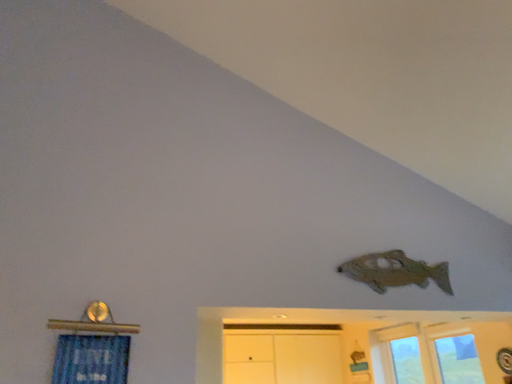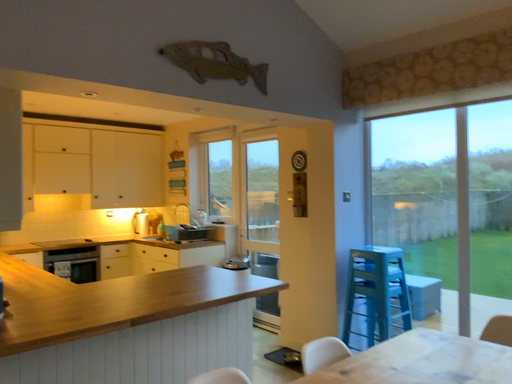
Question: How did the camera likely rotate when shooting the video?

Choices:
 (A) rotated downward
 (B) rotated upward

Answer: (A)